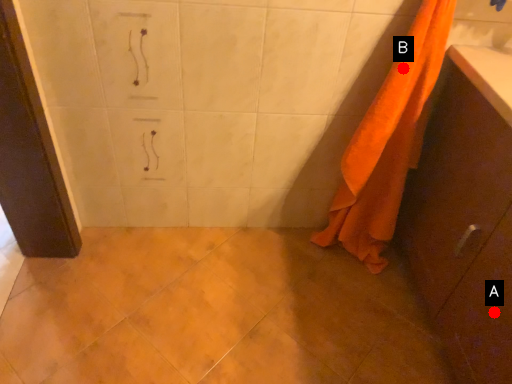
Question: Two points are circled on the image, labeled by A and B beside each circle. Which point is closer to the camera?

Choices:
 (A) A is closer
 (B) B is closer

Answer: (A)